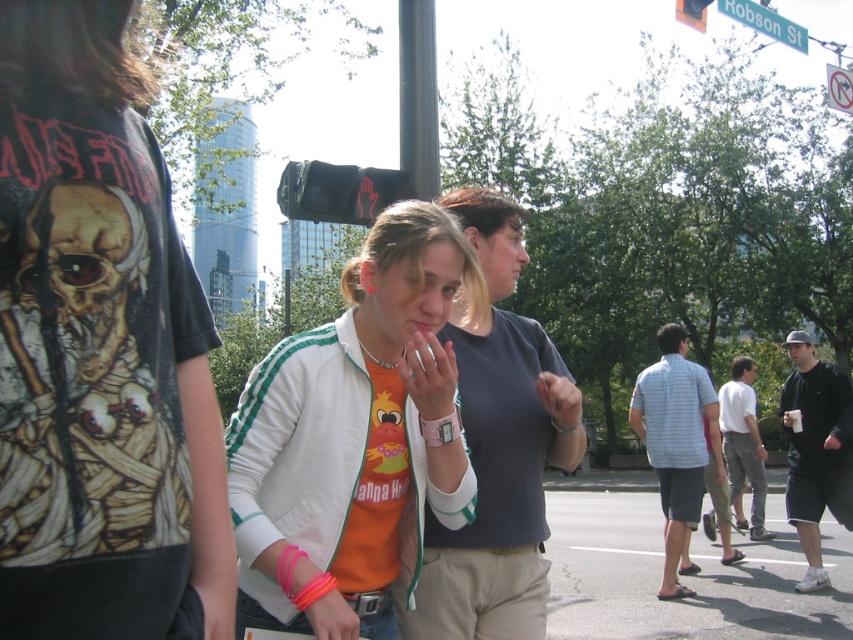
Is white matte jacket at center to the left of blue plastic street sign at upper center from the viewer's perspective?

Indeed, white matte jacket at center is positioned on the left side of blue plastic street sign at upper center.

Who is positioned more to the left, white matte jacket at center or blue plastic street sign at upper center?

white matte jacket at center

Image resolution: width=853 pixels, height=640 pixels. Identify the location of white matte jacket at center. (354, 438).

Can you confirm if light blue plaid shirt at center is thinner than black cotton t-shirt at right?

Incorrect, light blue plaid shirt at center's width is not less than black cotton t-shirt at right's.

Is light blue plaid shirt at center to the left of black cotton t-shirt at right from the viewer's perspective?

Indeed, light blue plaid shirt at center is positioned on the left side of black cotton t-shirt at right.

Who is more forward, (670, 333) or (843, 468)?

Point (843, 468) is in front.

Find the location of a particular element. The height and width of the screenshot is (640, 853). light blue plaid shirt at center is located at coordinates (676, 442).

Is white cotton shirt at right below blue plastic street sign at upper center?

Yes, white cotton shirt at right is below blue plastic street sign at upper center.

Is white cotton shirt at right bigger than blue plastic street sign at upper center?

Yes, white cotton shirt at right is bigger than blue plastic street sign at upper center.

This screenshot has width=853, height=640. What do you see at coordinates (743, 442) in the screenshot? I see `white cotton shirt at right` at bounding box center [743, 442].

You are a GUI agent. You are given a task and a screenshot of the screen. Output one action in this format:
    pyautogui.click(x=<x>, y=<y>)
    Task: Click on the white cotton shirt at right
    This screenshot has width=853, height=640.
    Given the screenshot: What is the action you would take?
    pyautogui.click(x=743, y=442)